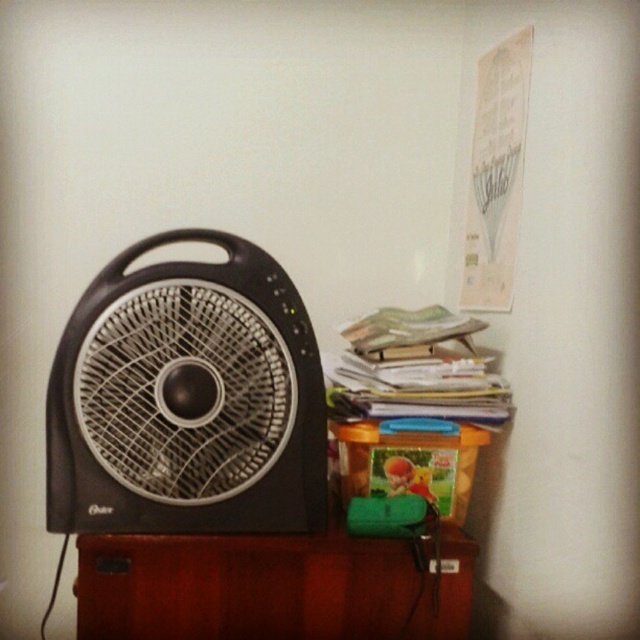
Which is behind, point (193, 525) or point (460, 586)?

The point (460, 586) is more distant.

Between black plastic fan at left and brown wood table at lower center, which one is positioned higher?

black plastic fan at left

At what (x,y) coordinates should I click in order to perform the action: click on black plastic fan at left. Please return your answer as a coordinate pair (x, y). Image resolution: width=640 pixels, height=640 pixels. Looking at the image, I should click on (186, 400).